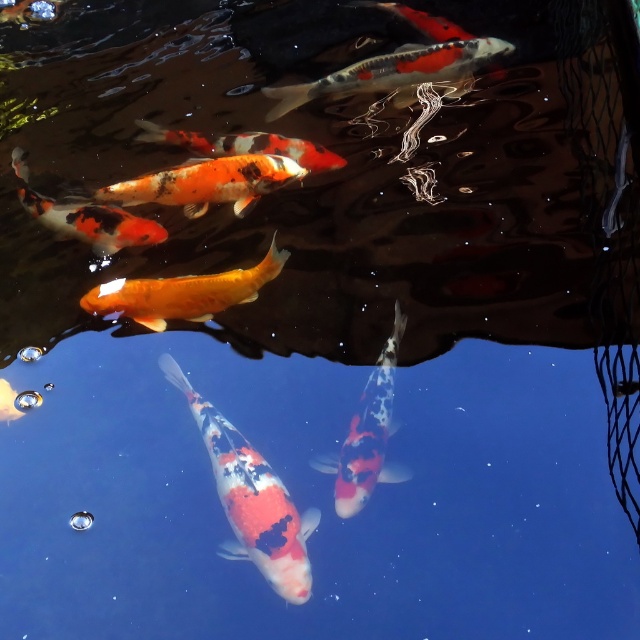
You are a photographer trying to capture the speckled orange fish at upper center in the pond. Based on its 2D location coordinates, where should you aim your camera to ensure it is centered in your shot?

To center the speckled orange fish at upper center in your shot, aim your camera at the coordinates point (396, 74), which is its 2D location.

From the picture: You are a photographer trying to capture the speckled orange fish at upper center in the pond. Based on its position coordinates, where should you aim your camera to get the best shot?

The speckled orange fish at upper center is located at coordinates point (396, 74), so you should aim your camera at that specific point to capture it effectively.